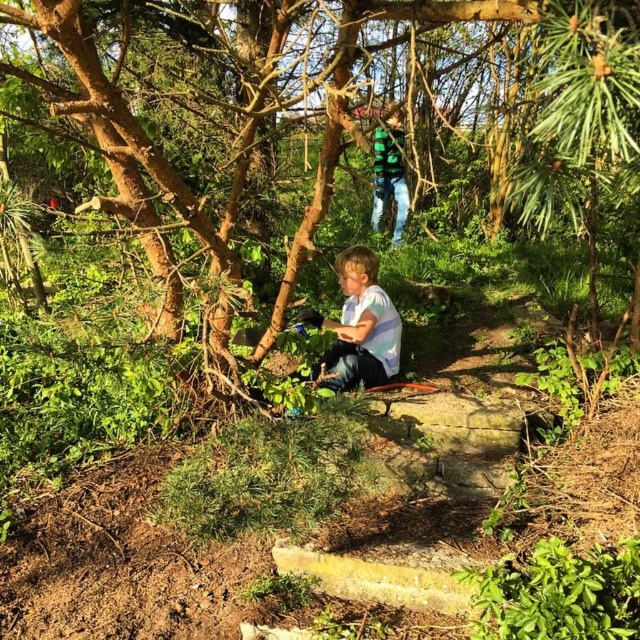
Measure the distance between point (x=362, y=314) and camera.

A distance of 3.85 meters exists between point (x=362, y=314) and camera.

Which is in front, point (349, 340) or point (401, 204)?

Point (349, 340) is in front.

This screenshot has height=640, width=640. Identify the location of white striped shirt at center. (358, 326).

I want to click on white striped shirt at center, so click(358, 326).

How far apart are brown rough tree at center and green striped shirt at upper center?

They are 2.14 meters apart.

Is point (307, 189) closer to viewer compared to point (381, 204)?

Yes, it is in front of point (381, 204).

You are a GUI agent. You are given a task and a screenshot of the screen. Output one action in this format:
    pyautogui.click(x=<x>, y=<y>)
    Task: Click on the brown rough tree at center
    
    Given the screenshot: What is the action you would take?
    pyautogui.click(x=234, y=125)

Does brown rough tree at center have a larger size compared to white striped shirt at center?

Yes.

In the scene shown: Who is positioned more to the left, brown rough tree at center or white striped shirt at center?

From the viewer's perspective, brown rough tree at center appears more on the left side.

Which is behind, point (536, 10) or point (358, 369)?

The point (358, 369) is behind.

Where is `brown rough tree at center`? brown rough tree at center is located at coordinates (234, 125).